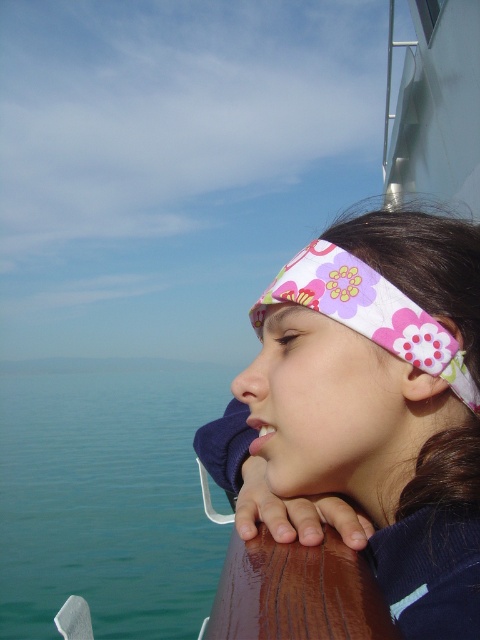
Question: Can you confirm if blue water at lower left is thinner than floral fabric headband at center?

Choices:
 (A) yes
 (B) no

Answer: (B)

Question: Does blue water at lower left appear on the left side of floral fabric headband at center?

Choices:
 (A) yes
 (B) no

Answer: (A)

Question: Considering the relative positions of blue water at lower left and floral fabric headband at center in the image provided, where is blue water at lower left located with respect to floral fabric headband at center?

Choices:
 (A) above
 (B) below

Answer: (B)

Question: Which object is farther from the camera taking this photo?

Choices:
 (A) floral fabric headband at center
 (B) blue water at lower left

Answer: (B)